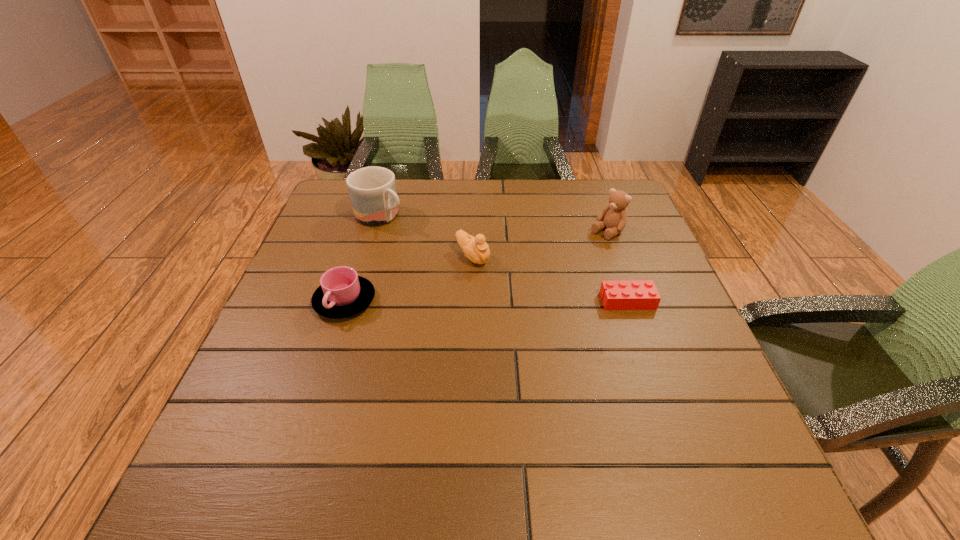
Find the location of a particular element. The image size is (960, 540). free spot on the desktop that is between the fourth tallest object and the Lego and is positioned on the face of the teddy bear is located at coordinates (508, 301).

Where is `free space on the desktop that is between the cup and the Lego and is positioned on the face of the third shortest object`? The height and width of the screenshot is (540, 960). free space on the desktop that is between the cup and the Lego and is positioned on the face of the third shortest object is located at coordinates (528, 301).

Image resolution: width=960 pixels, height=540 pixels. I want to click on vacant space on the desktop that is between the cup and the shortest object and is positioned on the side with the handle of the mug, so click(x=521, y=301).